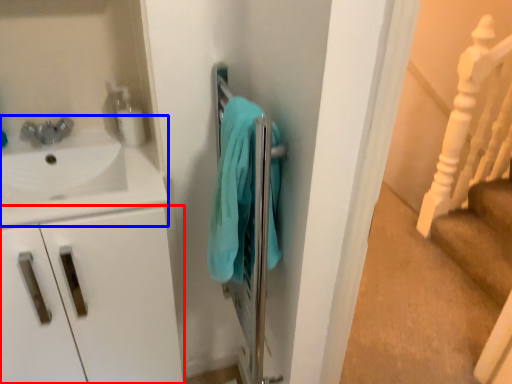
Question: Which object is further to the camera taking this photo, drawer (highlighted by a red box) or sink (highlighted by a blue box)?

Choices:
 (A) drawer
 (B) sink

Answer: (A)